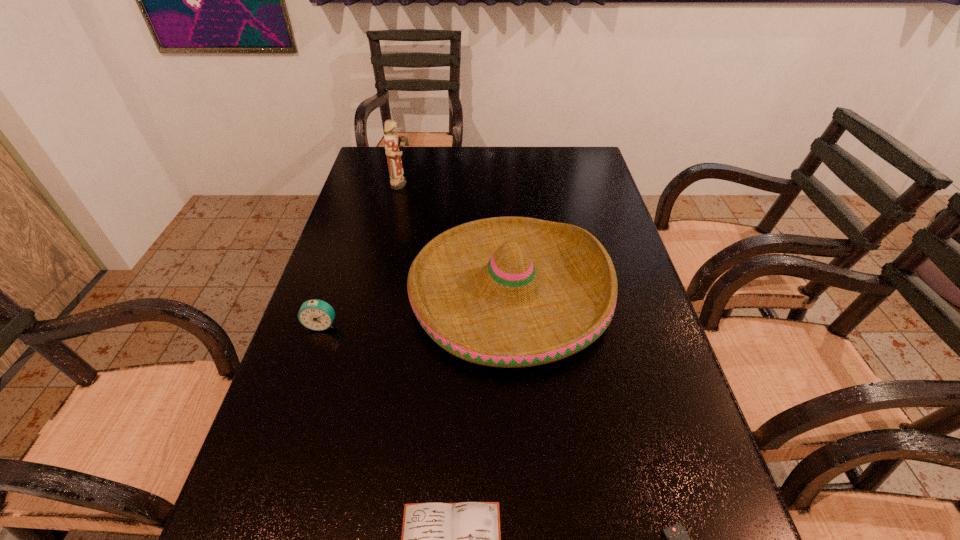
Where is `figurine`? Image resolution: width=960 pixels, height=540 pixels. figurine is located at coordinates (397, 181).

The height and width of the screenshot is (540, 960). Find the location of `the fourth object from right to left`. the fourth object from right to left is located at coordinates (397, 181).

Where is `sombrero`? This screenshot has width=960, height=540. sombrero is located at coordinates (510, 292).

The height and width of the screenshot is (540, 960). I want to click on alarm clock, so click(318, 315).

The height and width of the screenshot is (540, 960). What are the coordinates of `the leftmost object` in the screenshot? It's located at (318, 315).

What are the coordinates of `vacant space situated 0.110m on the front-facing side of the farthest object` in the screenshot? It's located at (446, 184).

Where is `free space located on the front of the sombrero`? This screenshot has width=960, height=540. free space located on the front of the sombrero is located at coordinates (520, 439).

At what (x,y) coordinates should I click in order to perform the action: click on vacant space situated 0.380m on the front-facing side of the third tallest object. Please return your answer as a coordinate pair (x, y). This screenshot has width=960, height=540. Looking at the image, I should click on (261, 506).

Locate an element on the screen. The width and height of the screenshot is (960, 540). object positioned at the far edge is located at coordinates (397, 181).

Locate an element on the screen. figurine that is positioned at the left edge is located at coordinates (397, 181).